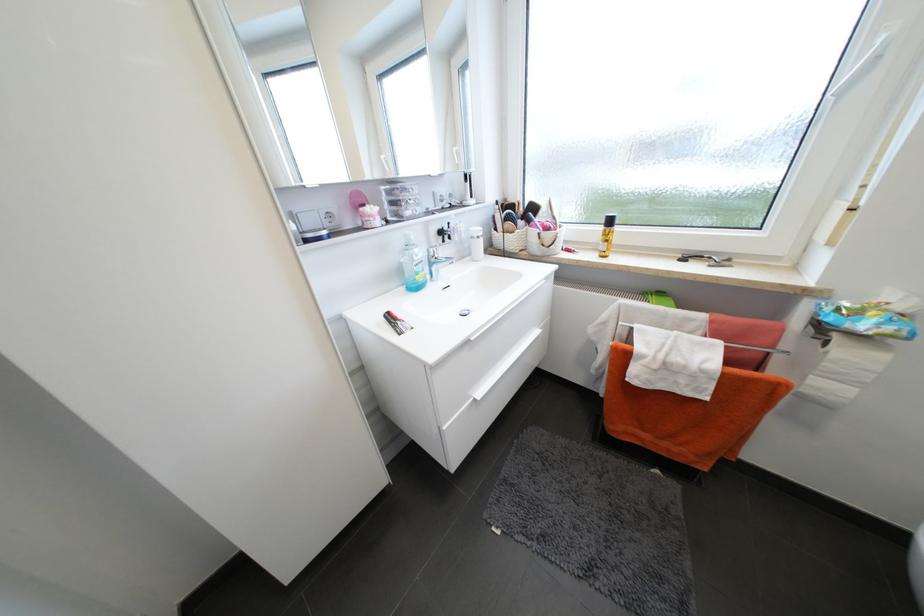
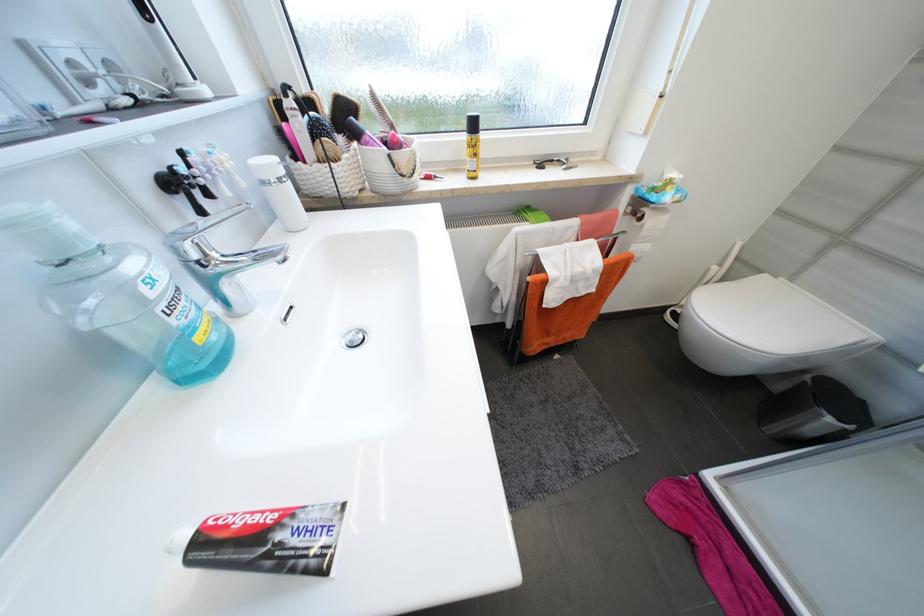
In the second image, find the point that corresponds to point 446,233 in the first image.

(178, 185)